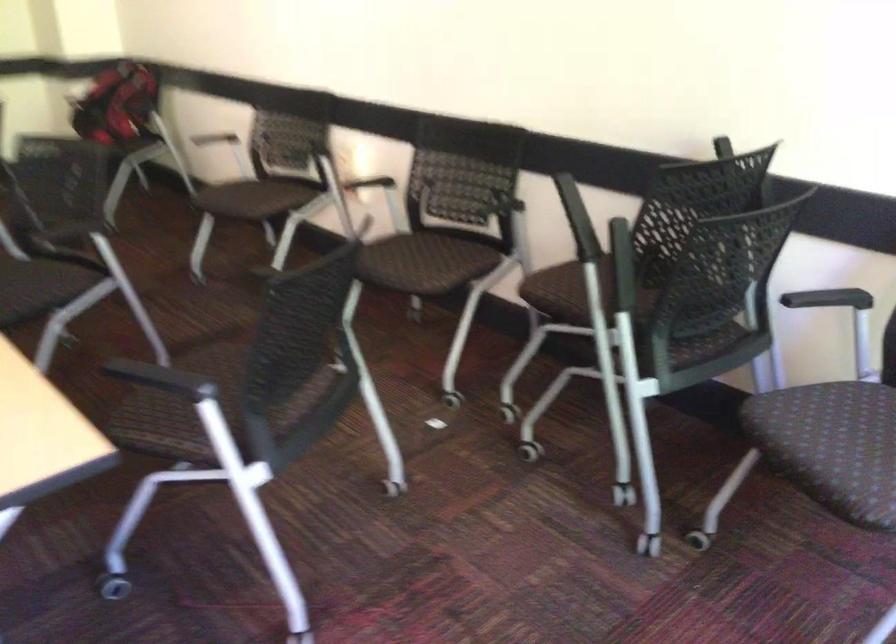
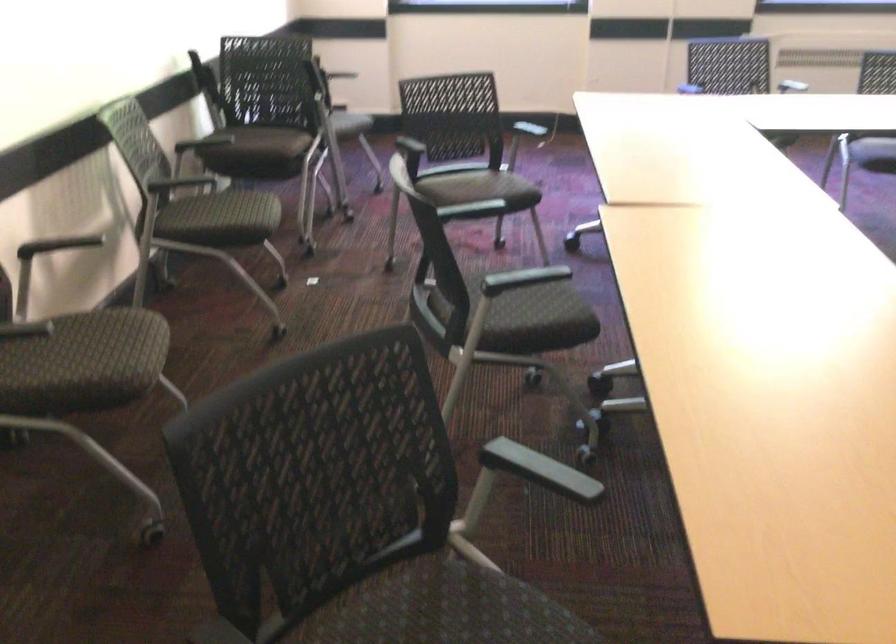
Find the pixel in the second image that matches (375,249) in the first image.

(250, 216)